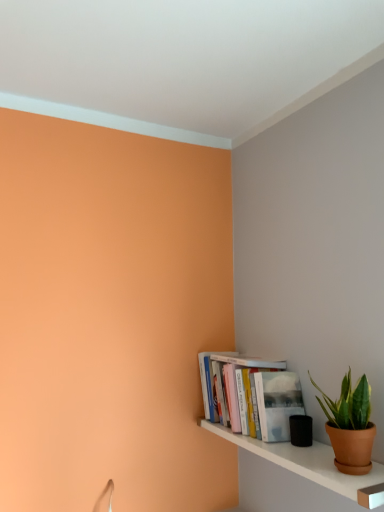
Question: Considering the positions of point (329, 485) and point (261, 422), is point (329, 485) closer or farther from the camera than point (261, 422)?

Choices:
 (A) closer
 (B) farther

Answer: (A)

Question: Considering the positions of white glossy shelf at lower right and hardcover books at lower right in the image, is white glossy shelf at lower right bigger or smaller than hardcover books at lower right?

Choices:
 (A) big
 (B) small

Answer: (B)

Question: Based on their relative distances, which object is nearer to the white glossy shelf at lower right?

Choices:
 (A) green matte plant pot at lower right
 (B) hardcover books at lower right

Answer: (B)

Question: Based on their relative distances, which object is nearer to the hardcover books at lower right?

Choices:
 (A) white glossy shelf at lower right
 (B) green matte plant pot at lower right

Answer: (A)